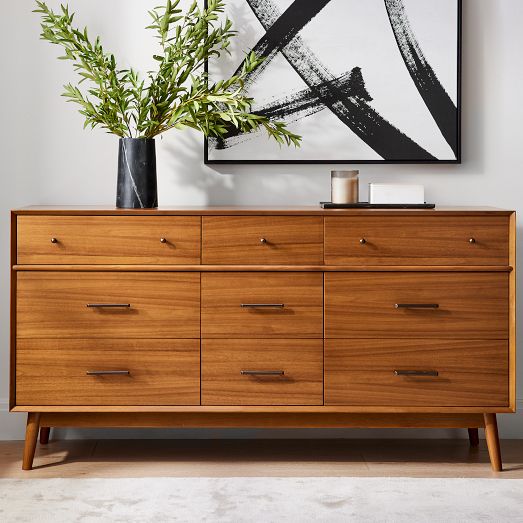
At what (x,y) coordinates should I click in order to perform the action: click on rear right foot of dresser. Please return your answer as a coordinate pair (x, y). The image size is (523, 523). Looking at the image, I should click on (475, 436).